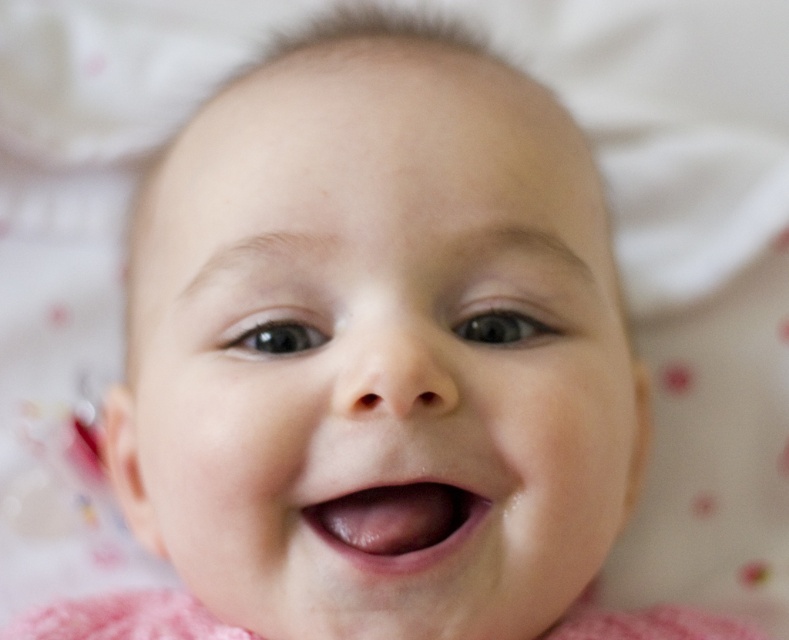
Question: Does smooth skin baby at center appear on the left side of pink glossy lips at center?

Choices:
 (A) no
 (B) yes

Answer: (B)

Question: Among these points, which one is farthest from the camera?

Choices:
 (A) (371, 248)
 (B) (451, 490)

Answer: (B)

Question: Is smooth skin baby at center to the right of pink glossy lips at center from the viewer's perspective?

Choices:
 (A) no
 (B) yes

Answer: (A)

Question: Is smooth skin baby at center thinner than pink glossy lips at center?

Choices:
 (A) no
 (B) yes

Answer: (A)

Question: Among these points, which one is farthest from the camera?

Choices:
 (A) 540,499
 (B) 408,488

Answer: (B)